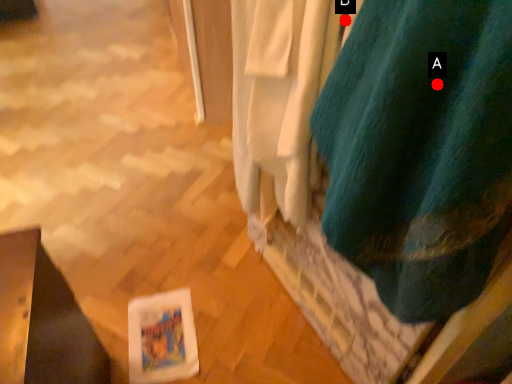
Question: Two points are circled on the image, labeled by A and B beside each circle. Which point appears closest to the camera in this image?

Choices:
 (A) A is closer
 (B) B is closer

Answer: (A)